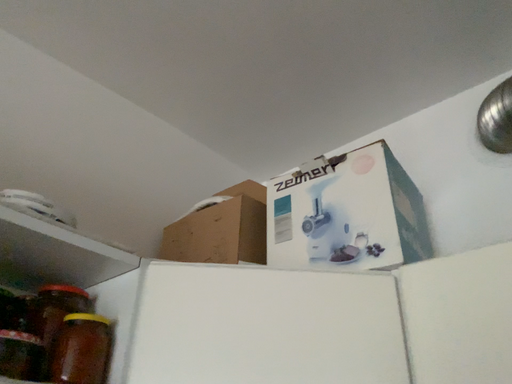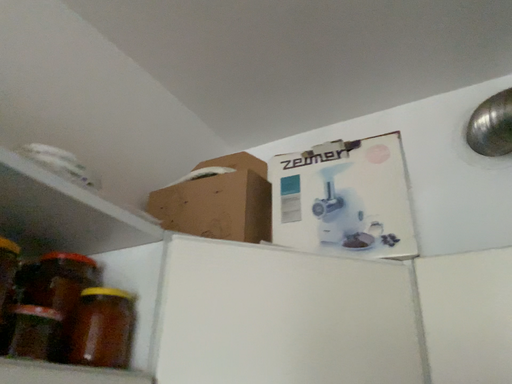
Question: How did the camera likely rotate when shooting the video?

Choices:
 (A) rotated right
 (B) rotated left

Answer: (A)